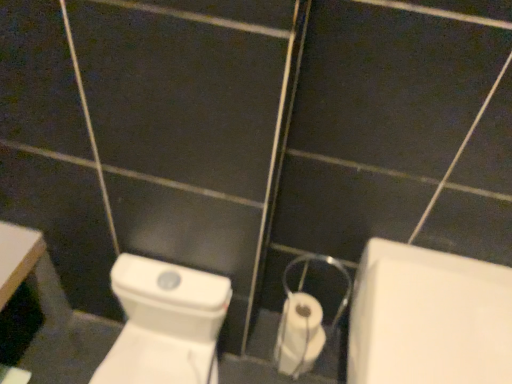
Question: Is white glossy bath at lower right positioned behind white glossy toilet at center?

Choices:
 (A) yes
 (B) no

Answer: (B)

Question: Considering the relative sizes of white glossy bath at lower right and white glossy toilet at center in the image provided, is white glossy bath at lower right wider than white glossy toilet at center?

Choices:
 (A) no
 (B) yes

Answer: (B)

Question: Considering the relative positions of white glossy bath at lower right and white glossy toilet at center in the image provided, is white glossy bath at lower right to the right of white glossy toilet at center from the viewer's perspective?

Choices:
 (A) yes
 (B) no

Answer: (A)

Question: Does white glossy bath at lower right come in front of white glossy toilet at center?

Choices:
 (A) yes
 (B) no

Answer: (A)

Question: Is white glossy toilet at center a part of white glossy bath at lower right?

Choices:
 (A) yes
 (B) no

Answer: (B)

Question: From the image's perspective, is white glossy bath at lower right on top of white glossy toilet at center?

Choices:
 (A) yes
 (B) no

Answer: (B)

Question: Is white glossy bath at lower right at the left side of white plastic toilet paper at center?

Choices:
 (A) yes
 (B) no

Answer: (B)

Question: Is white glossy bath at lower right behind white plastic toilet paper at center?

Choices:
 (A) yes
 (B) no

Answer: (B)

Question: Considering the relative sizes of white glossy bath at lower right and white plastic toilet paper at center in the image provided, is white glossy bath at lower right shorter than white plastic toilet paper at center?

Choices:
 (A) no
 (B) yes

Answer: (A)

Question: Is white glossy bath at lower right next to white plastic toilet paper at center?

Choices:
 (A) no
 (B) yes

Answer: (A)

Question: Can you confirm if white glossy bath at lower right is smaller than white plastic toilet paper at center?

Choices:
 (A) yes
 (B) no

Answer: (B)

Question: Is white glossy bath at lower right not near white plastic toilet paper at center?

Choices:
 (A) yes
 (B) no

Answer: (B)

Question: Can you confirm if white glossy toilet at center is smaller than white plastic toilet paper at center?

Choices:
 (A) yes
 (B) no

Answer: (B)